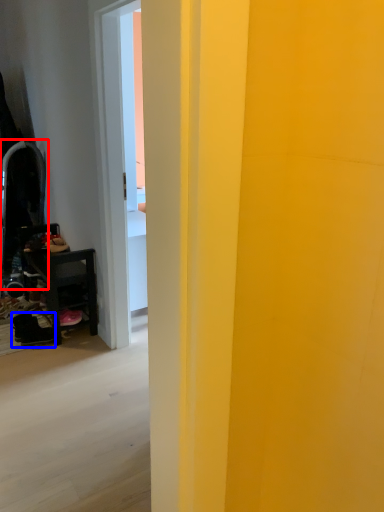
Question: Among these objects, which one is nearest to the camera, swivel chair (highlighted by a red box) or footwear (highlighted by a blue box)?

Choices:
 (A) swivel chair
 (B) footwear

Answer: (B)